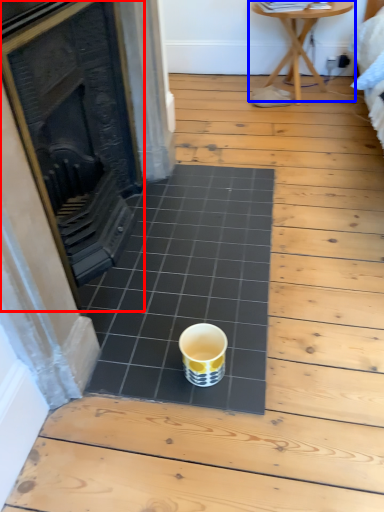
Question: Which object is closer to the camera taking this photo, fireplace (highlighted by a red box) or table (highlighted by a blue box)?

Choices:
 (A) fireplace
 (B) table

Answer: (A)